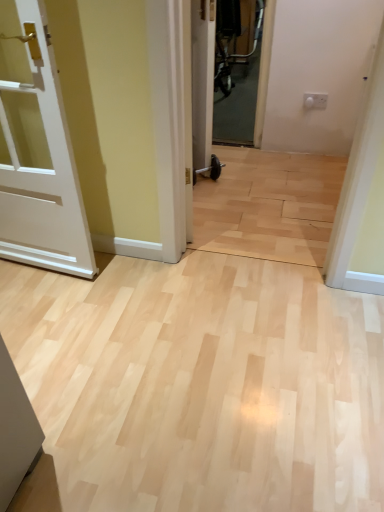
Question: Could white glossy door at center, positioned as the first door in top-to-bottom order, be considered to be inside white matte door at left, which appears as the first door when viewed from the left?

Choices:
 (A) yes
 (B) no

Answer: (B)

Question: Would you consider white matte door at left, the second door in the back-to-front sequence, to be distant from white glossy door at center, which ranks as the 2th door in bottom-to-top order?

Choices:
 (A) yes
 (B) no

Answer: (A)

Question: Can you confirm if white matte door at left, which is the 1th door from bottom to top, is bigger than white glossy door at center, which is the first door in back-to-front order?

Choices:
 (A) no
 (B) yes

Answer: (B)

Question: Is white matte door at left, arranged as the 2th door when viewed from the right, facing away from white glossy door at center, which is the second door in front-to-back order?

Choices:
 (A) no
 (B) yes

Answer: (A)

Question: Can you confirm if white matte door at left, which is the 1th door from bottom to top, is taller than white glossy door at center, which is the second door in front-to-back order?

Choices:
 (A) yes
 (B) no

Answer: (A)

Question: Is white matte door at left, arranged as the 1th door when viewed from the front, aimed at white glossy door at center, which is the first door in back-to-front order?

Choices:
 (A) no
 (B) yes

Answer: (A)

Question: Does white glossy door at center, positioned as the first door in top-to-bottom order, have a larger size compared to white matte door at left, which is the 1th door from bottom to top?

Choices:
 (A) no
 (B) yes

Answer: (A)

Question: Considering the relative positions of white glossy door at center, positioned as the first door in top-to-bottom order, and white matte door at left, the second door in the back-to-front sequence, in the image provided, is white glossy door at center, positioned as the first door in top-to-bottom order, behind white matte door at left, the second door in the back-to-front sequence,?

Choices:
 (A) no
 (B) yes

Answer: (B)

Question: Does white glossy door at center, which ranks as the 2th door in bottom-to-top order, have a greater height compared to white matte door at left, arranged as the 1th door when viewed from the front?

Choices:
 (A) yes
 (B) no

Answer: (B)

Question: Is white glossy door at center, positioned as the first door in top-to-bottom order, facing away from white matte door at left, which ranks as the 2th door in top-to-bottom order?

Choices:
 (A) no
 (B) yes

Answer: (A)

Question: Considering the relative positions of white glossy door at center, which is the first door in back-to-front order, and white matte door at left, which is the 1th door from bottom to top, in the image provided, is white glossy door at center, which is the first door in back-to-front order, to the left of white matte door at left, which is the 1th door from bottom to top, from the viewer's perspective?

Choices:
 (A) yes
 (B) no

Answer: (B)

Question: Is white glossy door at center, which is the second door in front-to-back order, surrounding white matte door at left, arranged as the 2th door when viewed from the right?

Choices:
 (A) yes
 (B) no

Answer: (B)

Question: Considering the positions of point 198,119 and point 46,150, is point 198,119 closer or farther from the camera than point 46,150?

Choices:
 (A) closer
 (B) farther

Answer: (B)